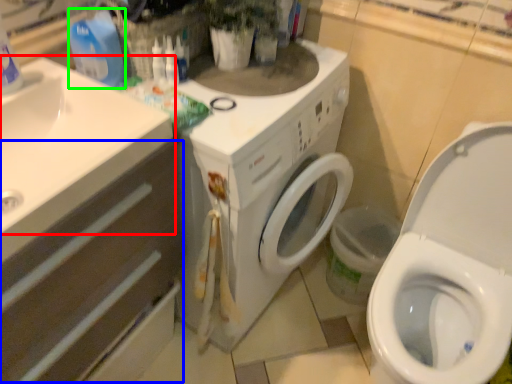
Question: Which object is positioned farthest from sink (highlighted by a red box)? Select from drawer (highlighted by a blue box) and cleaning product (highlighted by a green box).

Choices:
 (A) drawer
 (B) cleaning product

Answer: (B)